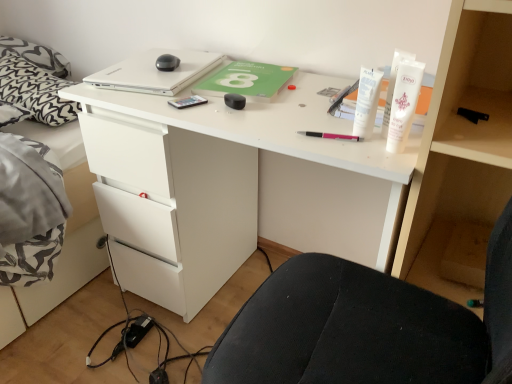
The height and width of the screenshot is (384, 512). Identify the location of free space that is in between satin silver phone at center, the 1th stationery when ordered from back to front, and pink plastic pen at center, the second stationery when ordered from front to back. (251, 119).